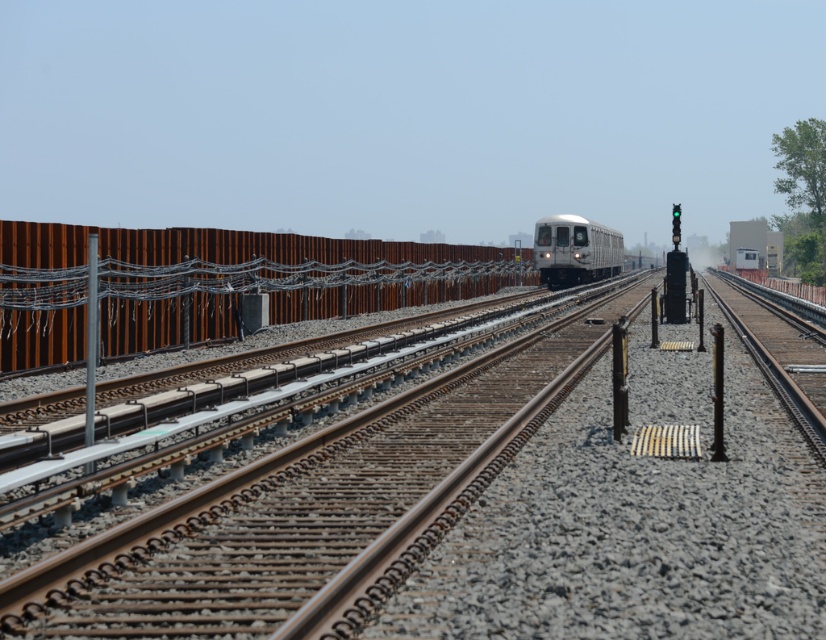
Question: Does brown metal train track at center appear on the right side of silver metallic train at center?

Choices:
 (A) no
 (B) yes

Answer: (A)

Question: Does brown metal train track at center have a lesser width compared to silver metallic train at center?

Choices:
 (A) yes
 (B) no

Answer: (A)

Question: Does brown metal train track at center appear over metallic pole at left?

Choices:
 (A) yes
 (B) no

Answer: (B)

Question: Which object is closer to the camera taking this photo?

Choices:
 (A) brown metal train track at center
 (B) metallic pole at left

Answer: (A)

Question: Which point is closer to the camera?

Choices:
 (A) silver metallic train at center
 (B) metallic pole at left
 (C) brown metal train track at center

Answer: (C)

Question: Which point appears closest to the camera in this image?

Choices:
 (A) (578, 268)
 (B) (383, 484)
 (C) (88, 465)

Answer: (C)